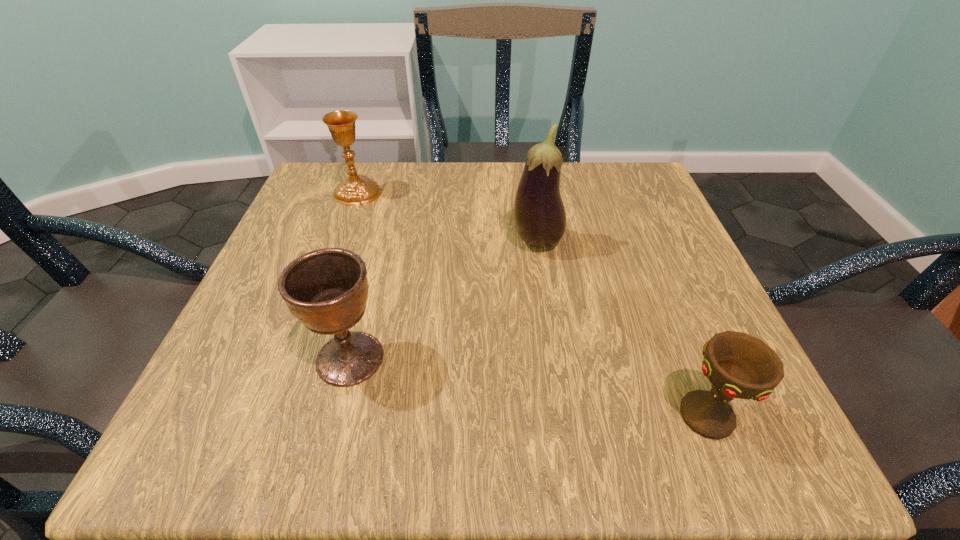
You are a GUI agent. You are given a task and a screenshot of the screen. Output one action in this format:
    pyautogui.click(x=<x>, y=<y>)
    Task: Click on the free space between the third object from left to right and the farthest chalice
    The width and height of the screenshot is (960, 540).
    Given the screenshot: What is the action you would take?
    [447, 217]

Where is `unoccupied position between the tallest object and the rightmost chalice`? unoccupied position between the tallest object and the rightmost chalice is located at coordinates (621, 329).

In order to click on vacant area between the tallest object and the rightmost object in this screenshot , I will do pyautogui.click(x=621, y=329).

You are a GUI agent. You are given a task and a screenshot of the screen. Output one action in this format:
    pyautogui.click(x=<x>, y=<y>)
    Task: Click on the free space between the tallest object and the farthest chalice
    This screenshot has height=540, width=960.
    Given the screenshot: What is the action you would take?
    pyautogui.click(x=447, y=217)

Identify the location of free area in between the third object from left to right and the farthest object. This screenshot has height=540, width=960. (447, 217).

Locate an element on the screen. The height and width of the screenshot is (540, 960). empty space that is in between the eggplant and the farthest object is located at coordinates (447, 217).

Where is `object identified as the closest to the third nearest object`? This screenshot has height=540, width=960. object identified as the closest to the third nearest object is located at coordinates (327, 289).

Locate an element on the screen. object that is the third closest to the rightmost object is located at coordinates (357, 190).

I want to click on chalice that is the second closest one to the shortest object, so click(x=357, y=190).

Where is `chalice that can be found as the second closest to the rightmost chalice`? This screenshot has height=540, width=960. chalice that can be found as the second closest to the rightmost chalice is located at coordinates (357, 190).